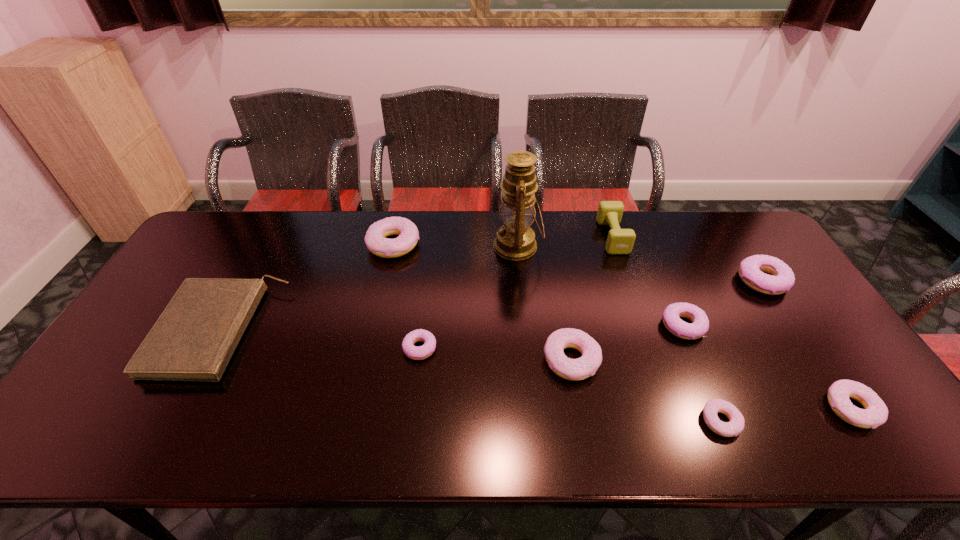
The width and height of the screenshot is (960, 540). I want to click on free area in between the leftmost object and the smallest purple doughnut, so click(320, 339).

I want to click on empty space that is in between the second smallest purple doughnut and the farthest pink doughnut, so click(539, 285).

At what (x,y) coordinates should I click in order to perform the action: click on free space between the smallest pink doughnut and the paperback book. Please return your answer as a coordinate pair (x, y). This screenshot has height=540, width=960. Looking at the image, I should click on (470, 376).

Select which object is the ninth closest to the second pink doughnut from left to right. Please provide its 2D coordinates. Your answer should be formatted as a tuple, i.e. [(x, y)], where the tuple contains the x and y coordinates of a point satisfying the conditions above.

[(195, 337)]

Locate an element on the screen. object that is the sixth closest to the farthest purple doughnut is located at coordinates (515, 240).

Choose which doughnut is the sixth nearest neighbor to the olive dumbbell. Please provide its 2D coordinates. Your answer should be formatted as a tuple, i.e. [(x, y)], where the tuple contains the x and y coordinates of a point satisfying the conditions above.

[(375, 239)]

Identify which doughnut is the sixth nearest to the smallest purple doughnut. Please provide its 2D coordinates. Your answer should be formatted as a tuple, i.e. [(x, y)], where the tuple contains the x and y coordinates of a point satisfying the conditions above.

[(875, 413)]

Locate an element on the screen. pink doughnut identified as the second closest to the olive dumbbell is located at coordinates (736, 425).

Point out which pink doughnut is positioned as the third nearest to the second farthest pink doughnut. Please provide its 2D coordinates. Your answer should be formatted as a tuple, i.e. [(x, y)], where the tuple contains the x and y coordinates of a point satisfying the conditions above.

[(875, 413)]

At what (x,y) coordinates should I click in order to perform the action: click on purple doughnut that can be found as the closest to the second smallest pink doughnut. Please return your answer as a coordinate pair (x, y). This screenshot has height=540, width=960. Looking at the image, I should click on (700, 324).